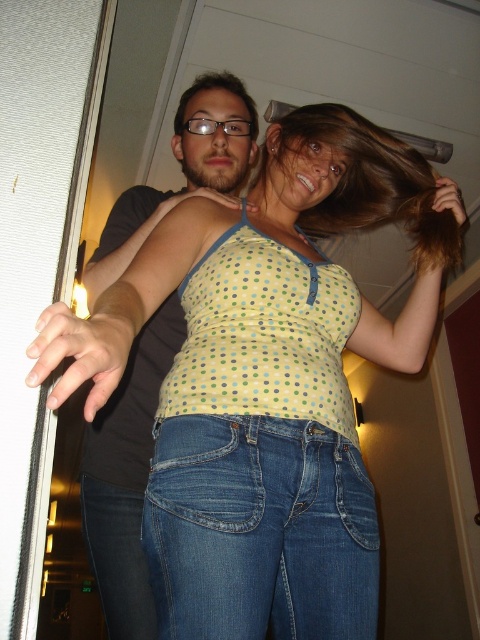
Who is taller, blue denim jeans at lower center or yellow polka dot tank top at center?

With more height is yellow polka dot tank top at center.

Who is shorter, blue denim jeans at lower center or yellow polka dot tank top at center?

blue denim jeans at lower center

Identify the location of blue denim jeans at lower center. (260, 531).

Is yellow polka dot tank top at center to the right of brown silky hair at upper center from the viewer's perspective?

Incorrect, yellow polka dot tank top at center is not on the right side of brown silky hair at upper center.

Which of these two, yellow polka dot tank top at center or brown silky hair at upper center, stands taller?

Standing taller between the two is yellow polka dot tank top at center.

Who is more distant from viewer, [241,301] or [382,163]?

The point [382,163] is behind.

This screenshot has width=480, height=640. I want to click on yellow polka dot tank top at center, so click(x=264, y=333).

Is yellow polka dot tank top at center to the left of jeans at lower left from the viewer's perspective?

Incorrect, yellow polka dot tank top at center is not on the left side of jeans at lower left.

Between yellow polka dot tank top at center and jeans at lower left, which one has more height?

With more height is yellow polka dot tank top at center.

Where is `yellow polka dot tank top at center`? The width and height of the screenshot is (480, 640). yellow polka dot tank top at center is located at coordinates (264, 333).

Where is `yellow polka dot tank top at center`? This screenshot has height=640, width=480. yellow polka dot tank top at center is located at coordinates (264, 333).